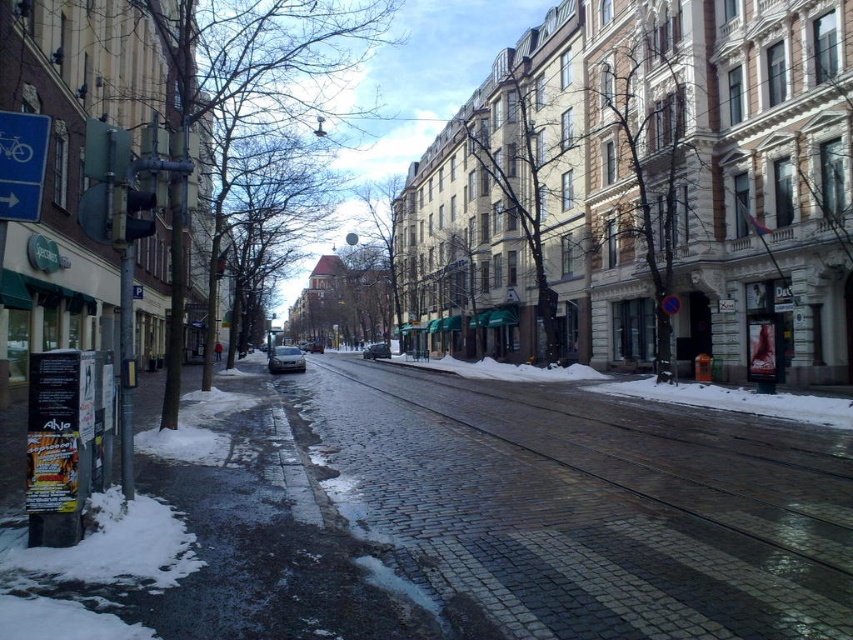
Between satin silver car at center and black glossy car at center, which one appears on the right side from the viewer's perspective?

black glossy car at center

Can you confirm if satin silver car at center is smaller than black glossy car at center?

No, satin silver car at center is not smaller than black glossy car at center.

What do you see at coordinates (285, 358) in the screenshot?
I see `satin silver car at center` at bounding box center [285, 358].

You are a GUI agent. You are given a task and a screenshot of the screen. Output one action in this format:
    pyautogui.click(x=<x>, y=<y>)
    Task: Click on the satin silver car at center
    The width and height of the screenshot is (853, 640).
    Given the screenshot: What is the action you would take?
    (285, 358)

Who is higher up, dark gray cobblestone pavement at center or black glossy car at center?

black glossy car at center

How much distance is there between dark gray cobblestone pavement at center and black glossy car at center?

dark gray cobblestone pavement at center and black glossy car at center are 173.13 feet apart.

Is point (257, 493) closer to camera compared to point (370, 353)?

Yes, it is.

Where is `dark gray cobblestone pavement at center`? dark gray cobblestone pavement at center is located at coordinates (453, 518).

Can you confirm if dark gray cobblestone pavement at center is positioned below satin silver car at center?

Yes, dark gray cobblestone pavement at center is below satin silver car at center.

Does point (308, 442) come behind point (303, 365)?

That is False.

Find the location of a particular element. dark gray cobblestone pavement at center is located at coordinates (453, 518).

This screenshot has height=640, width=853. What are the coordinates of `dark gray cobblestone pavement at center` in the screenshot? It's located at (453, 518).